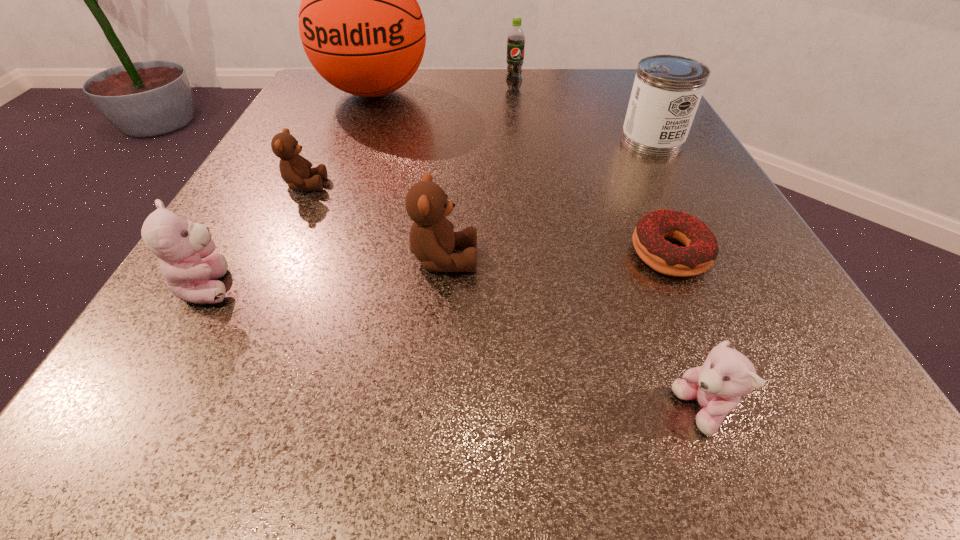
Where is `the nearest teddy bear`? This screenshot has height=540, width=960. the nearest teddy bear is located at coordinates (726, 375).

Image resolution: width=960 pixels, height=540 pixels. What are the coordinates of `the smaller pink teddy bear` in the screenshot? It's located at (726, 375).

Where is `chocolate doughnut`? Image resolution: width=960 pixels, height=540 pixels. chocolate doughnut is located at coordinates (701, 250).

Where is `the shortest object`? This screenshot has height=540, width=960. the shortest object is located at coordinates (701, 250).

The image size is (960, 540). Find the location of `vacant area situated 0.160m on the side with logo of the basketball`. vacant area situated 0.160m on the side with logo of the basketball is located at coordinates (348, 161).

The width and height of the screenshot is (960, 540). In order to click on free space located on the front label of the green soda in this screenshot , I will do `click(527, 195)`.

Find the location of a particular element. blank space located 0.260m on the left of the third farthest object is located at coordinates (482, 140).

Where is `free location located on the face of the bigger brown teddy bear`? The height and width of the screenshot is (540, 960). free location located on the face of the bigger brown teddy bear is located at coordinates (734, 259).

You are a GUI agent. You are given a task and a screenshot of the screen. Output one action in this format:
    pyautogui.click(x=<x>, y=<y>)
    Task: Click on the free location located 0.400m at the face of the farther pink teddy bear
    This screenshot has height=540, width=960.
    Given the screenshot: What is the action you would take?
    pyautogui.click(x=550, y=286)

At what (x,y) coordinates should I click in order to perform the action: click on free space located on the face of the fifth nearest object. Please return your answer as a coordinate pair (x, y). Looking at the image, I should click on (412, 185).